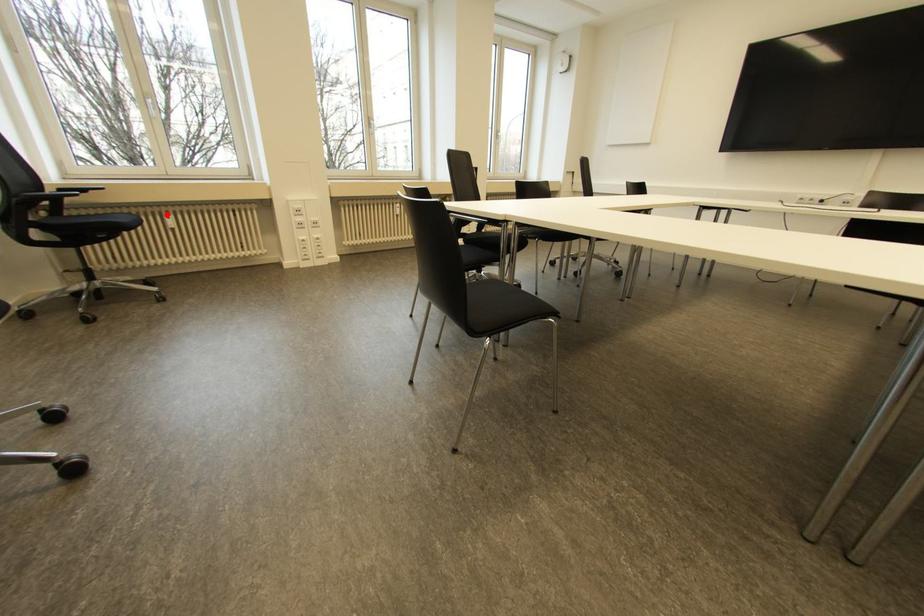
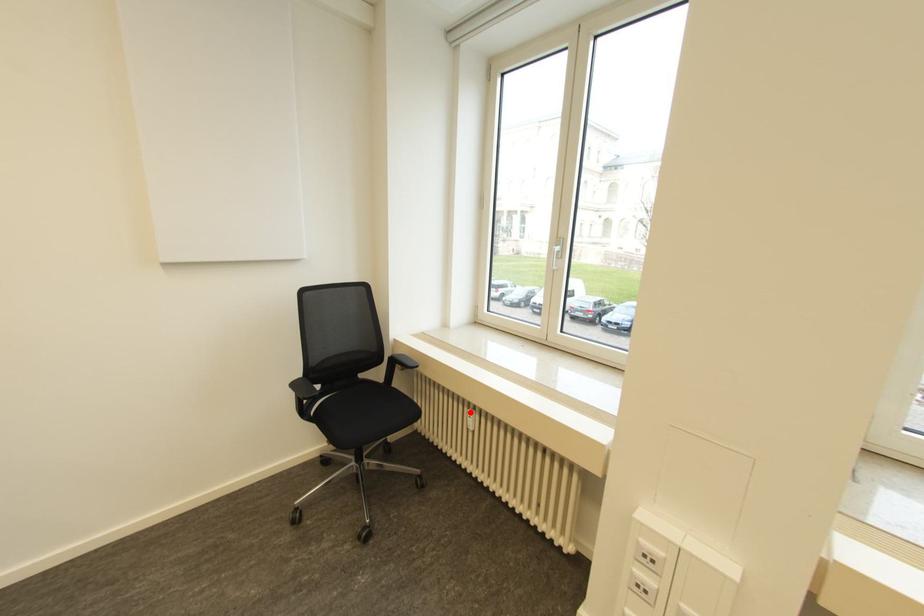
I am providing you with two images of the same scene from different viewpoints. A red point is marked on the first image and another point is marked on the second image. Do the highlighted points in image1 and image2 indicate the same real-world spot?

Yes